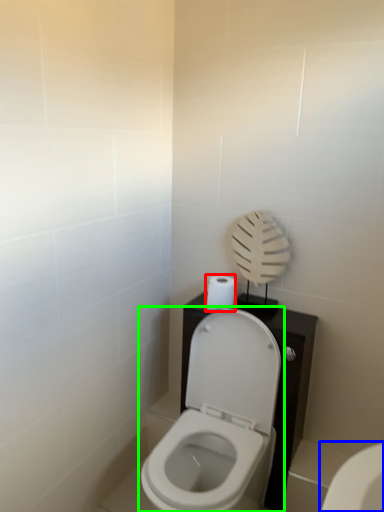
Question: Considering the real-world distances, which object is closest to toilet paper (highlighted by a red box)? toilet (highlighted by a blue box) or toilet (highlighted by a green box).

Choices:
 (A) toilet
 (B) toilet

Answer: (B)